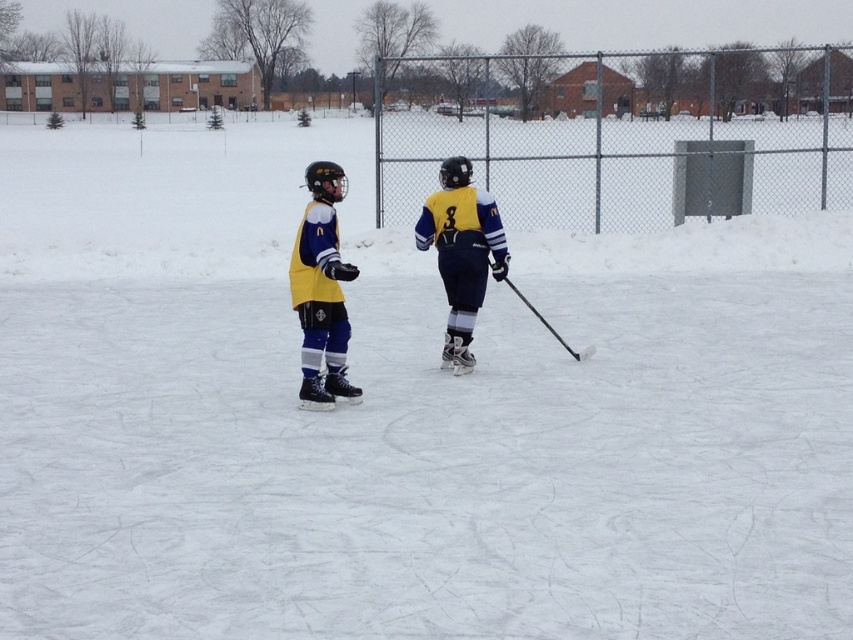
Which is in front, point (332, 179) or point (418, 227)?

Positioned in front is point (332, 179).

Can you confirm if yellow matte hockey jersey at center is bigger than yellow jersey at center?

Yes, yellow matte hockey jersey at center is bigger than yellow jersey at center.

Which is behind, point (315, 317) or point (463, 253)?

The point (463, 253) is behind.

Locate an element on the screen. This screenshot has height=640, width=853. yellow matte hockey jersey at center is located at coordinates (321, 291).